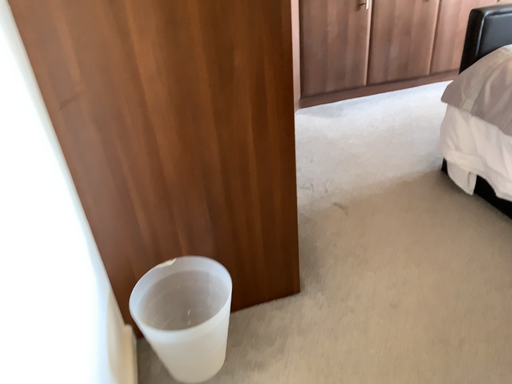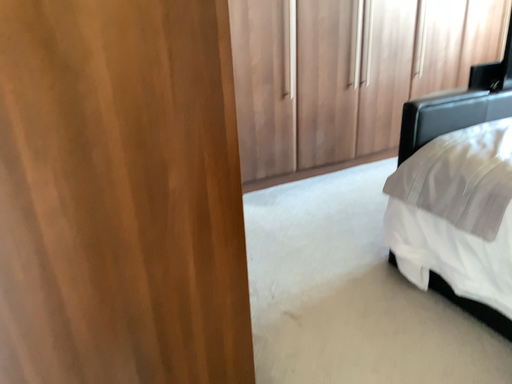
Question: How did the camera likely rotate when shooting the video?

Choices:
 (A) rotated left
 (B) rotated right

Answer: (B)